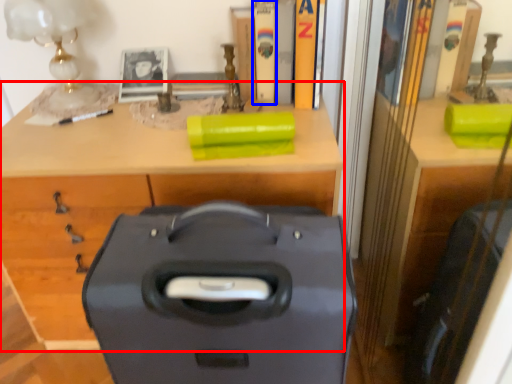
Question: Among these objects, which one is farthest to the camera, desk (highlighted by a red box) or book (highlighted by a blue box)?

Choices:
 (A) desk
 (B) book

Answer: (B)